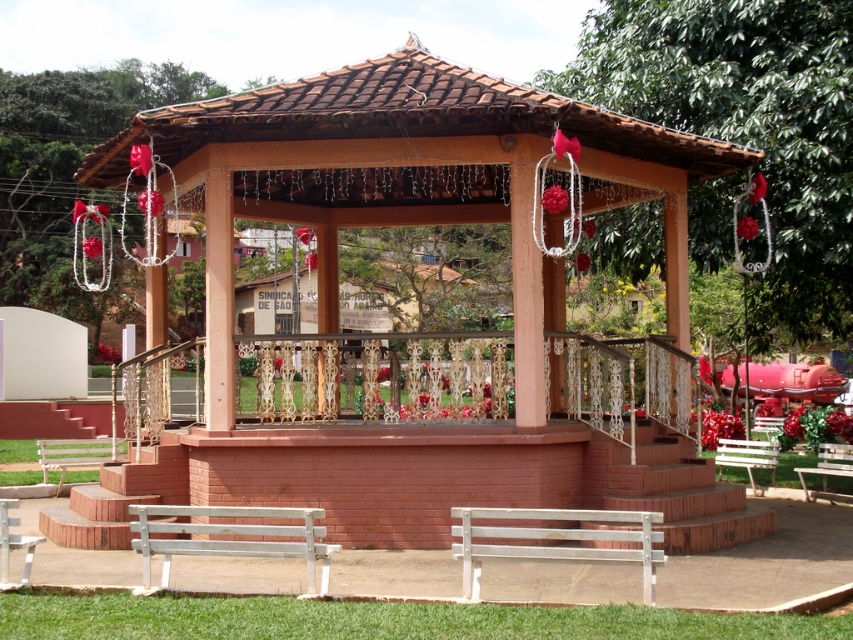
Does white painted wood bench at lower center lie in front of white wooden bench at lower left?

Yes, white painted wood bench at lower center is in front of white wooden bench at lower left.

Does white painted wood bench at lower center have a larger size compared to white wooden bench at lower left?

Yes, white painted wood bench at lower center is bigger than white wooden bench at lower left.

The height and width of the screenshot is (640, 853). What are the coordinates of `white painted wood bench at lower center` in the screenshot? It's located at (556, 538).

Does white wooden bench at lower left have a greater width compared to white wooden bench at center?

In fact, white wooden bench at lower left might be narrower than white wooden bench at center.

Does white wooden bench at lower left appear on the right side of white wooden bench at center?

No, white wooden bench at lower left is not to the right of white wooden bench at center.

Is point (68, 445) positioned before point (845, 467)?

No, (68, 445) is behind (845, 467).

Locate an element on the screen. The image size is (853, 640). white wooden bench at lower left is located at coordinates (76, 454).

Which is more to the right, brown brick gazebo at center or white wooden bench at center?

white wooden bench at center is more to the right.

Can you confirm if brown brick gazebo at center is thinner than white wooden bench at center?

Incorrect, brown brick gazebo at center's width is not less than white wooden bench at center's.

You are a GUI agent. You are given a task and a screenshot of the screen. Output one action in this format:
    pyautogui.click(x=<x>, y=<y>)
    Task: Click on the brown brick gazebo at center
    Image resolution: width=853 pixels, height=640 pixels.
    Given the screenshot: What is the action you would take?
    pyautogui.click(x=430, y=340)